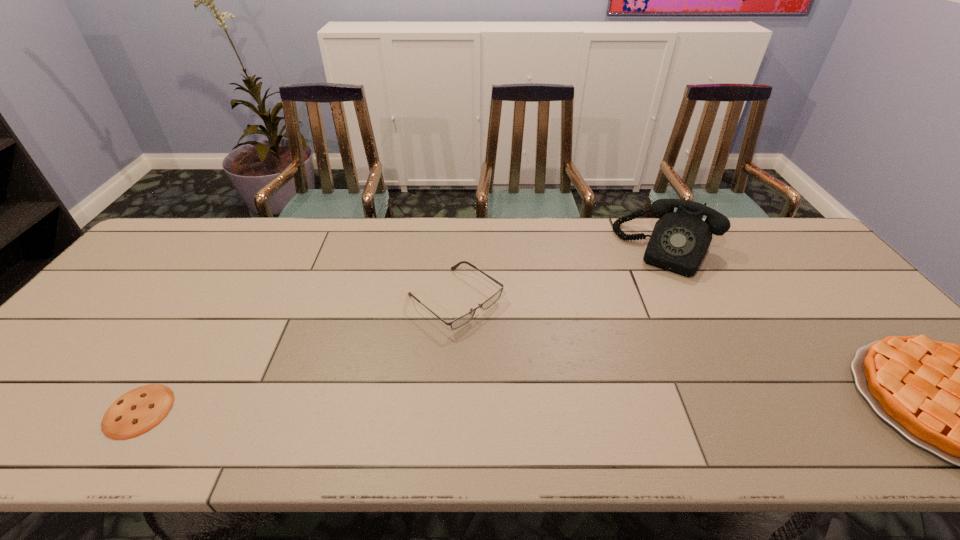
Locate an element on the screen. empty location between the cookie and the tallest object is located at coordinates (403, 330).

This screenshot has height=540, width=960. Identify the location of empty space between the cookie and the spectacles. (297, 355).

Find the location of `vacant area that lies between the third tallest object and the shortest object`. vacant area that lies between the third tallest object and the shortest object is located at coordinates (297, 355).

Where is `vacant space that's between the second object from left to right and the leftmost object`? The image size is (960, 540). vacant space that's between the second object from left to right and the leftmost object is located at coordinates (297, 355).

Locate which object ranks third in proximity to the third tallest object. Please provide its 2D coordinates. Your answer should be formatted as a tuple, i.e. [(x, y)], where the tuple contains the x and y coordinates of a point satisfying the conditions above.

[(959, 402)]

Identify the location of object that stands as the closest to the second object from right to left. The width and height of the screenshot is (960, 540). click(959, 402).

Find the location of `free space in the image that satisfies the following two spatial constraints: 1. on the back side of the shortest object; 2. on the right side of the spectacles`. free space in the image that satisfies the following two spatial constraints: 1. on the back side of the shortest object; 2. on the right side of the spectacles is located at coordinates (212, 300).